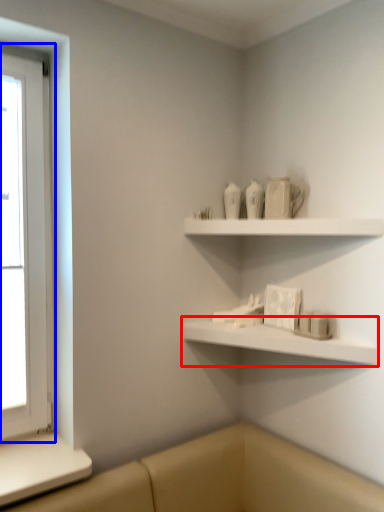
Question: Which of the following is the farthest to the observer, shelf (highlighted by a red box) or window (highlighted by a blue box)?

Choices:
 (A) shelf
 (B) window

Answer: (B)